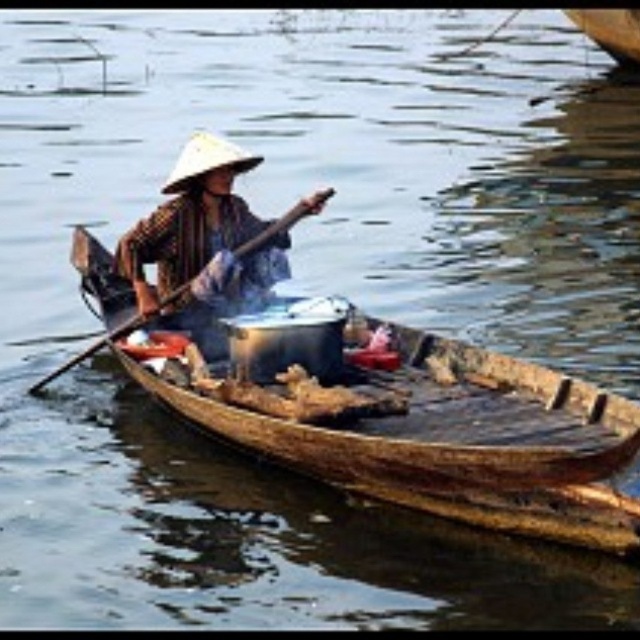
Question: Which of these objects is positioned closest to the wooden boat at upper right?

Choices:
 (A) brown woven hat at center
 (B) white straw hat at center
 (C) wooden paddle at center

Answer: (B)

Question: Which point is farther to the camera?

Choices:
 (A) (196, 160)
 (B) (257, 163)
 (C) (625, 12)

Answer: (C)

Question: Which point is closer to the camera?

Choices:
 (A) (291, 218)
 (B) (138, 275)
 (C) (600, 48)

Answer: (A)

Question: Can you confirm if brown woven hat at center is thinner than white straw hat at center?

Choices:
 (A) no
 (B) yes

Answer: (A)

Question: Does brown woven hat at center appear on the right side of wooden paddle at center?

Choices:
 (A) no
 (B) yes

Answer: (B)

Question: Does wooden paddle at center appear over wooden boat at upper right?

Choices:
 (A) no
 (B) yes

Answer: (A)